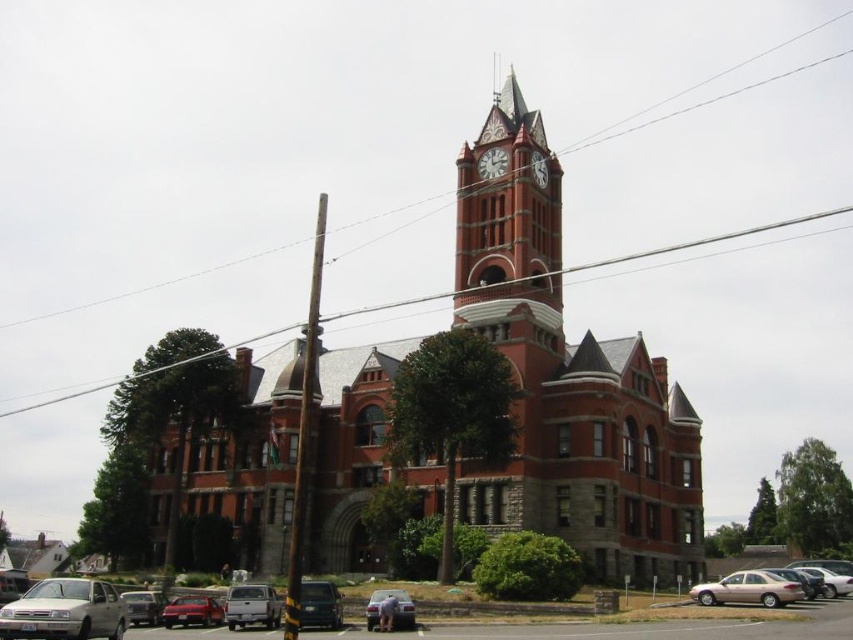
Does metallic silver car at lower center come behind matte black sedan at lower left?

Yes, metallic silver car at lower center is behind matte black sedan at lower left.

Can you confirm if metallic silver car at lower center is positioned to the right of matte black sedan at lower left?

Correct, you'll find metallic silver car at lower center to the right of matte black sedan at lower left.

Which is behind, point (415, 625) or point (149, 621)?

The point (149, 621) is more distant.

Identify the location of metallic silver car at lower center. (392, 611).

Does point (149, 611) lie behind point (476, 168)?

No, (149, 611) is in front of (476, 168).

Between point (132, 616) and point (497, 161), which one is positioned in front?

Point (132, 616)

Locate an element on the screen. This screenshot has height=640, width=853. matte black sedan at lower left is located at coordinates (143, 605).

Is metallic wire at upper center taller than silver metallic sedan at lower left?

Yes.

Can you confirm if metallic wire at upper center is smaller than silver metallic sedan at lower left?

Incorrect, metallic wire at upper center is not smaller in size than silver metallic sedan at lower left.

The image size is (853, 640). I want to click on metallic wire at upper center, so click(717, 96).